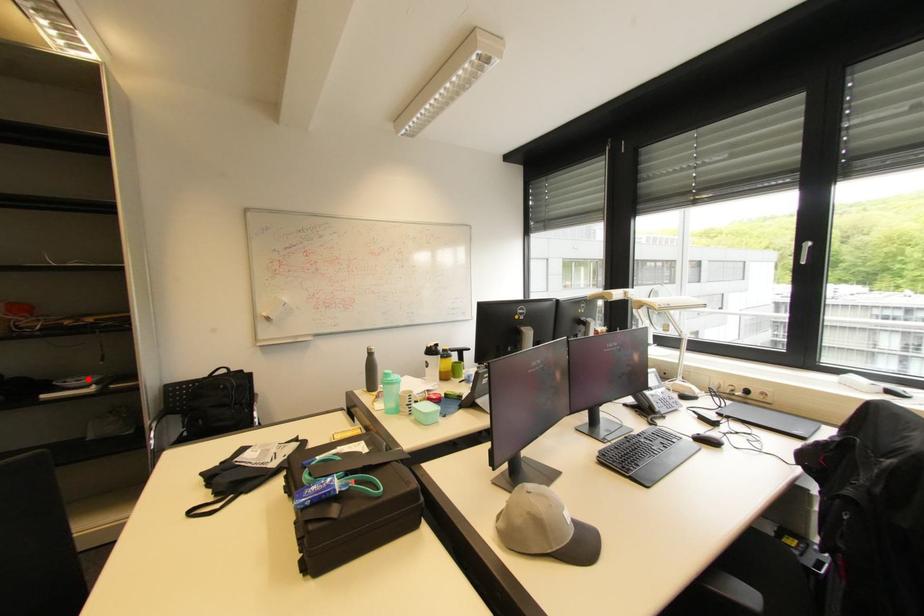
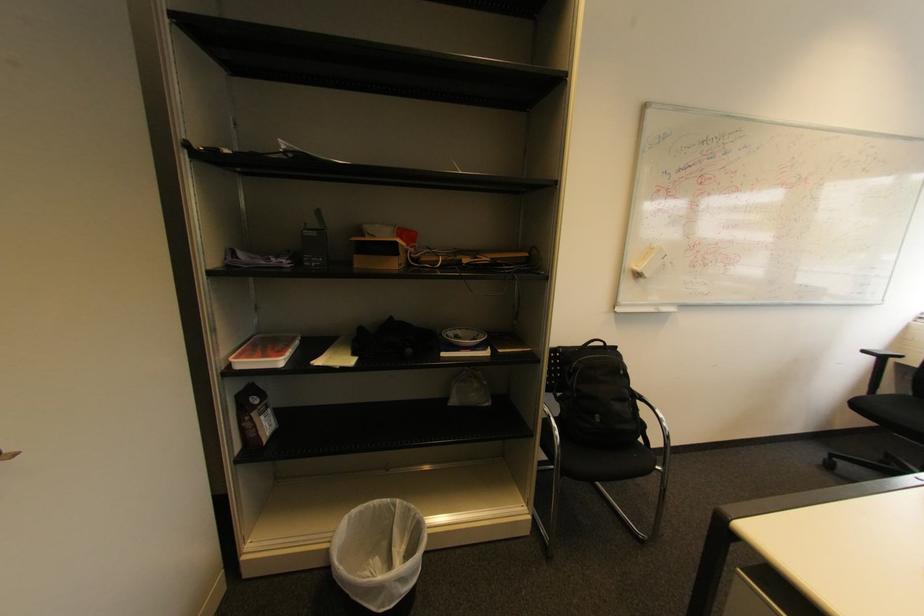
The point at the highlighted location is marked in the first image. Where is the corresponding point in the second image?

(464, 333)